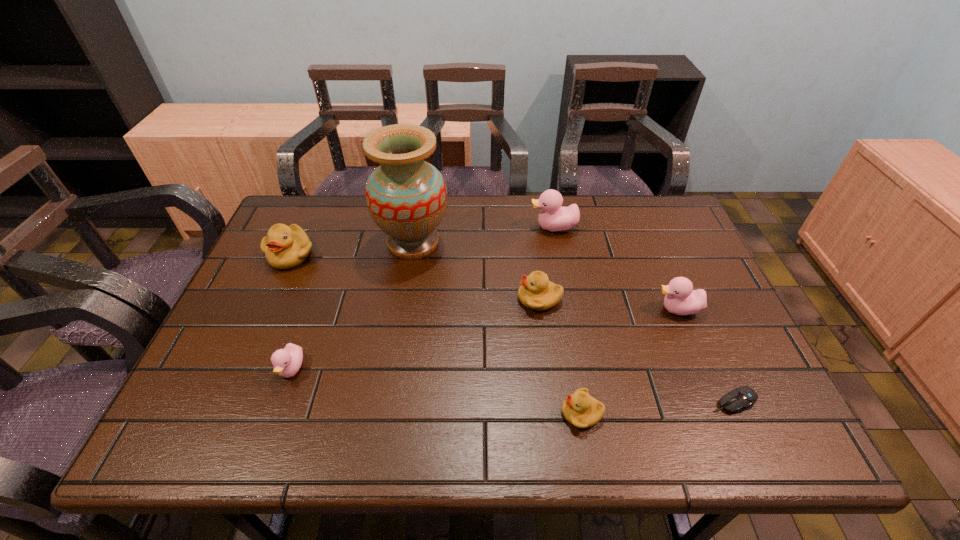
Locate an element on the screen. This screenshot has width=960, height=540. vase present at the far edge is located at coordinates (406, 196).

What are the coordinates of `duckling located in the near edge section of the desktop` in the screenshot? It's located at (580, 409).

Where is `computer mouse that is at the near edge`? The image size is (960, 540). computer mouse that is at the near edge is located at coordinates (743, 398).

Locate an element on the screen. object present at the left edge is located at coordinates (285, 247).

Find the location of a particular element. The height and width of the screenshot is (540, 960). duckling present at the right edge is located at coordinates (681, 299).

Locate an element on the screen. This screenshot has width=960, height=540. computer mouse that is at the right edge is located at coordinates (743, 398).

At what (x,y) coordinates should I click in order to perform the action: click on object situated at the far left corner. Please return your answer as a coordinate pair (x, y). The width and height of the screenshot is (960, 540). Looking at the image, I should click on (285, 247).

This screenshot has height=540, width=960. What are the coordinates of `object present at the near right corner` in the screenshot? It's located at (743, 398).

The image size is (960, 540). Find the location of `vacant space at the far edge of the desktop`. vacant space at the far edge of the desktop is located at coordinates (614, 241).

Locate an element on the screen. Image resolution: width=960 pixels, height=540 pixels. vacant area at the near edge is located at coordinates (588, 450).